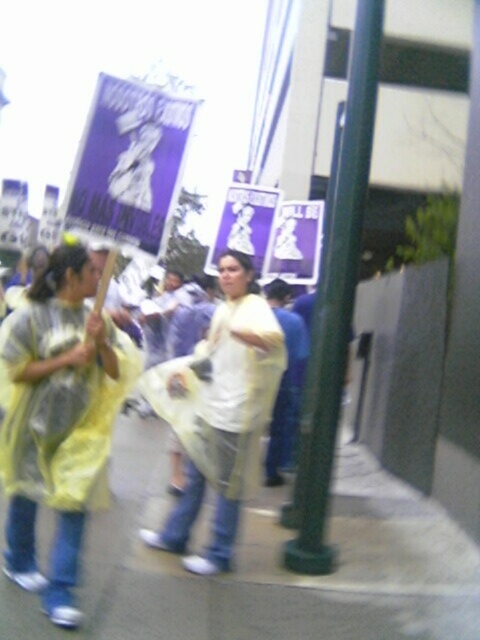
You are a photographer trying to capture a clear photo of the white matte shirt at center while standing on the smooth concrete pavement at lower center. Can you fit both objects in your camera frame if your camera has a 3.5 feet field of view?

The smooth concrete pavement at lower center and white matte shirt at center are 3.49 feet apart from each other. Since the distance between them is just under 3.5 feet, your camera with a 3.5 feet field of view can capture both objects in the frame.